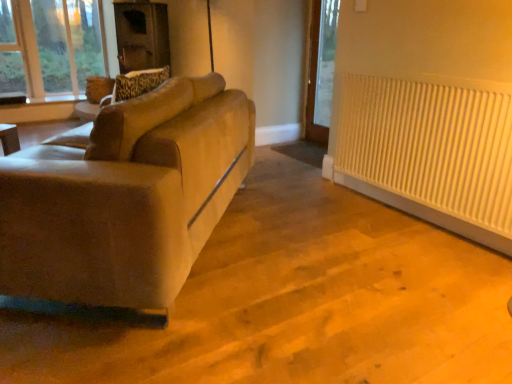
What do you see at coordinates (430, 146) in the screenshot? The height and width of the screenshot is (384, 512). I see `white ribbed radiator at right` at bounding box center [430, 146].

Locate an element on the screen. Image resolution: width=512 pixels, height=384 pixels. suede-like beige couch at left is located at coordinates (126, 198).

The height and width of the screenshot is (384, 512). Describe the element at coordinates (136, 84) in the screenshot. I see `beige fabric swivel chair at left` at that location.

What are the coordinates of `white ribbed radiator at right` in the screenshot? It's located at (430, 146).

Considering the relative sizes of white ribbed radiator at right and beige fabric swivel chair at left in the image provided, is white ribbed radiator at right bigger than beige fabric swivel chair at left?

Correct, white ribbed radiator at right is larger in size than beige fabric swivel chair at left.

Is white ribbed radiator at right to the left of beige fabric swivel chair at left from the viewer's perspective?

No, white ribbed radiator at right is not to the left of beige fabric swivel chair at left.

From a real-world perspective, between white ribbed radiator at right and beige fabric swivel chair at left, who is vertically lower?

white ribbed radiator at right.

From the image's perspective, would you say white ribbed radiator at right is positioned over suede-like beige couch at left?

Correct, white ribbed radiator at right appears higher than suede-like beige couch at left in the image.

Does point (453, 107) come farther from viewer compared to point (53, 281)?

Yes, point (453, 107) is behind point (53, 281).

Is white ribbed radiator at right shorter than suede-like beige couch at left?

In fact, white ribbed radiator at right may be taller than suede-like beige couch at left.

Looking at their sizes, would you say white ribbed radiator at right is wider or thinner than suede-like beige couch at left?

Clearly, white ribbed radiator at right has less width compared to suede-like beige couch at left.

Looking at the image, does suede-like beige couch at left seem bigger or smaller compared to beige fabric swivel chair at left?

Considering their sizes, suede-like beige couch at left takes up more space than beige fabric swivel chair at left.

In terms of height, does suede-like beige couch at left look taller or shorter compared to beige fabric swivel chair at left?

Clearly, suede-like beige couch at left is taller compared to beige fabric swivel chair at left.

Is suede-like beige couch at left at the right side of beige fabric swivel chair at left?

Incorrect, suede-like beige couch at left is not on the right side of beige fabric swivel chair at left.

From a real-world perspective, is beige fabric swivel chair at left beneath suede-like beige couch at left?

No, from a real-world perspective, beige fabric swivel chair at left is not under suede-like beige couch at left.

Is beige fabric swivel chair at left facing away from suede-like beige couch at left?

Yes, beige fabric swivel chair at left is facing away from suede-like beige couch at left.

Is beige fabric swivel chair at left at the right side of suede-like beige couch at left?

Yes, beige fabric swivel chair at left is to the right of suede-like beige couch at left.

Does beige fabric swivel chair at left come behind white ribbed radiator at right?

No, beige fabric swivel chair at left is closer to the viewer.

Is beige fabric swivel chair at left turned away from white ribbed radiator at right?

Absolutely, beige fabric swivel chair at left is directed away from white ribbed radiator at right.

From the image's perspective, which one is positioned lower, beige fabric swivel chair at left or white ribbed radiator at right?

white ribbed radiator at right.

Which is more to the right, beige fabric swivel chair at left or white ribbed radiator at right?

Positioned to the right is white ribbed radiator at right.

Does point (155, 115) appear closer or farther from the camera than point (479, 101)?

Point (155, 115) is positioned closer to the camera compared to point (479, 101).

Is suede-like beige couch at left in contact with white ribbed radiator at right?

suede-like beige couch at left and white ribbed radiator at right are clearly separated.

Is white ribbed radiator at right completely or partially inside suede-like beige couch at left?

No.

Is suede-like beige couch at left facing towards white ribbed radiator at right?

No, suede-like beige couch at left is not turned towards white ribbed radiator at right.

The height and width of the screenshot is (384, 512). Find the location of `radiator to the right of beige fabric swivel chair at left`. radiator to the right of beige fabric swivel chair at left is located at coordinates (430, 146).

You are a GUI agent. You are given a task and a screenshot of the screen. Output one action in this format:
    pyautogui.click(x=<x>, y=<y>)
    Task: Click on the radiator above the suede-like beige couch at left (from the image's perspective)
    
    Given the screenshot: What is the action you would take?
    pyautogui.click(x=430, y=146)

Looking at the image, which one is located closer to suede-like beige couch at left, white ribbed radiator at right or beige fabric swivel chair at left?

The object closer to suede-like beige couch at left is beige fabric swivel chair at left.

From the image, which object appears to be farther from suede-like beige couch at left, beige fabric swivel chair at left or white ribbed radiator at right?

white ribbed radiator at right is further to suede-like beige couch at left.

From the image, which object appears to be nearer to beige fabric swivel chair at left, suede-like beige couch at left or white ribbed radiator at right?

Among the two, suede-like beige couch at left is located nearer to beige fabric swivel chair at left.

Looking at this image, when comparing their distances from white ribbed radiator at right, does beige fabric swivel chair at left or suede-like beige couch at left seem further?

beige fabric swivel chair at left lies further to white ribbed radiator at right than the other object.

When comparing their distances from white ribbed radiator at right, does suede-like beige couch at left or beige fabric swivel chair at left seem further?

beige fabric swivel chair at left is further to white ribbed radiator at right.

When comparing their distances from beige fabric swivel chair at left, does white ribbed radiator at right or suede-like beige couch at left seem further?

The object further to beige fabric swivel chair at left is white ribbed radiator at right.

Locate an element on the screen. swivel chair situated between suede-like beige couch at left and white ribbed radiator at right from left to right is located at coordinates (136, 84).